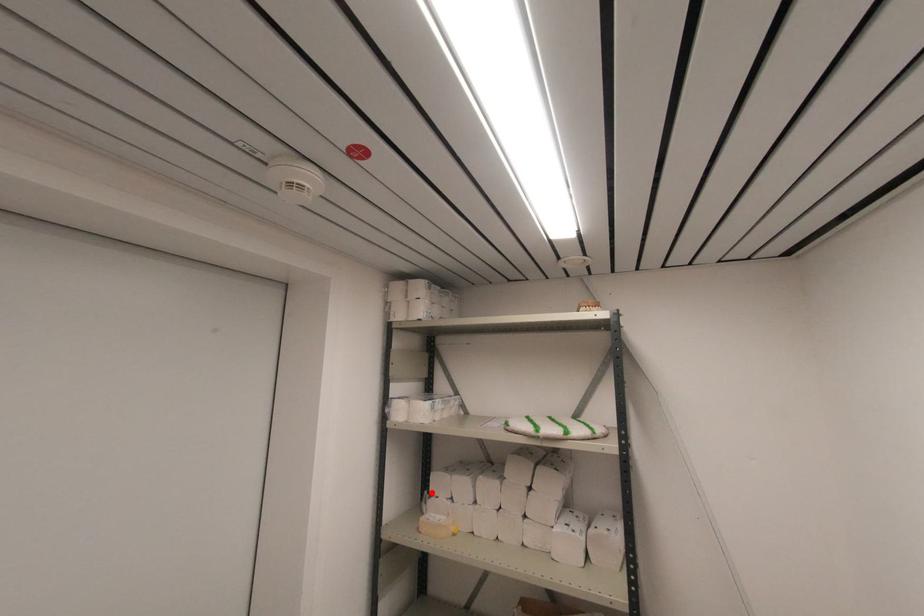
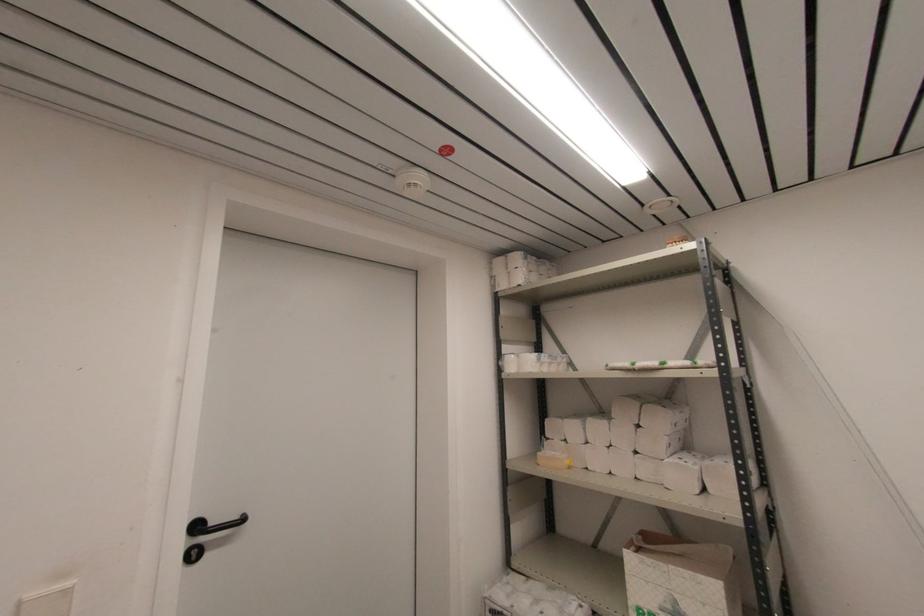
In the second image, find the point that corresponds to the highlighted location in the first image.

(548, 436)